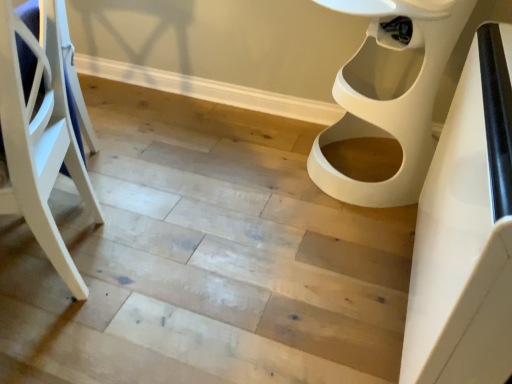
Describe the element at coordinates (40, 137) in the screenshot. Image resolution: width=512 pixels, height=384 pixels. I see `white wood chair at left` at that location.

This screenshot has width=512, height=384. What do you see at coordinates (390, 93) in the screenshot?
I see `white plastic toilet at right` at bounding box center [390, 93].

Find the location of a particular element. white wood chair at left is located at coordinates (40, 137).

From the image's perspective, is white plastic toilet at right positioned above or below white wood chair at left?

Clearly, from the image's perspective, white plastic toilet at right is above white wood chair at left.

Can you tell me how much white plastic toilet at right and white wood chair at left differ in facing direction?

The angular difference between white plastic toilet at right and white wood chair at left is 69.2 degrees.

Which is behind, white plastic toilet at right or white wood chair at left?

white plastic toilet at right is more distant.

Which object is thinner, white glossy table at right or white plastic toilet at right?

Thinner between the two is white glossy table at right.

In terms of size, does white glossy table at right appear bigger or smaller than white plastic toilet at right?

white glossy table at right is smaller than white plastic toilet at right.

Does white glossy table at right come behind white plastic toilet at right?

No, white glossy table at right is closer to the viewer.

Which is more to the left, white glossy table at right or white plastic toilet at right?

From the viewer's perspective, white plastic toilet at right appears more on the left side.

Is point (416, 127) closer to camera compared to point (467, 374)?

No, (416, 127) is further to viewer.

Between white plastic toilet at right and white glossy table at right, which one has smaller width?

Thinner between the two is white glossy table at right.

Considering the relative positions of white plastic toilet at right and white glossy table at right in the image provided, is white plastic toilet at right to the right of white glossy table at right from the viewer's perspective?

In fact, white plastic toilet at right is to the left of white glossy table at right.

In the image, is white wood chair at left on the left side or the right side of white plastic toilet at right?

In the image, white wood chair at left appears on the left side of white plastic toilet at right.

Is white wood chair at left aimed at white plastic toilet at right?

No, white wood chair at left is not facing towards white plastic toilet at right.

You are a GUI agent. You are given a task and a screenshot of the screen. Output one action in this format:
    pyautogui.click(x=<x>, y=<y>)
    Task: Click on the furniture in front of the white plastic toilet at right
    The image size is (512, 384).
    Given the screenshot: What is the action you would take?
    pyautogui.click(x=40, y=137)

Is white wood chair at left spatially inside white plastic toilet at right, or outside of it?

white wood chair at left is outside white plastic toilet at right.

Is white glossy table at right oriented towards white wood chair at left?

Yes, white glossy table at right is oriented towards white wood chair at left.

In the scene shown: Considering the relative positions of white glossy table at right and white wood chair at left in the image provided, is white glossy table at right to the left of white wood chair at left from the viewer's perspective?

No, white glossy table at right is not to the left of white wood chair at left.

Consider the image. Which object is wider, white glossy table at right or white wood chair at left?

white wood chair at left is wider.

From the image's perspective, is white glossy table at right located beneath white wood chair at left?

Yes, from the image's perspective, white glossy table at right is beneath white wood chair at left.

From their relative heights in the image, would you say white wood chair at left is taller or shorter than white glossy table at right?

white wood chair at left is taller than white glossy table at right.

Is white wood chair at left thinner than white glossy table at right?

In fact, white wood chair at left might be wider than white glossy table at right.

Is white wood chair at left bigger or smaller than white glossy table at right?

Clearly, white wood chair at left is larger in size than white glossy table at right.

The width and height of the screenshot is (512, 384). In order to click on furniture below the white plastic toilet at right (from the image's perspective) in this screenshot , I will do `click(40, 137)`.

Where is `table in front of the white plastic toilet at right`? This screenshot has height=384, width=512. table in front of the white plastic toilet at right is located at coordinates (466, 231).

Looking at the image, which one is located further to white wood chair at left, white plastic toilet at right or white glossy table at right?

Based on the image, white plastic toilet at right appears to be further to white wood chair at left.

Which object lies further to the anchor point white glossy table at right, white plastic toilet at right or white wood chair at left?

white wood chair at left is further to white glossy table at right.

Based on their spatial positions, is white glossy table at right or white wood chair at left closer to white plastic toilet at right?

white glossy table at right.

Looking at the image, which one is located further to white glossy table at right, white wood chair at left or white plastic toilet at right?

white wood chair at left.

Considering their positions, is white glossy table at right positioned closer to white wood chair at left than white plastic toilet at right?

Among the two, white glossy table at right is located nearer to white wood chair at left.

From the image, which object appears to be farther from white plastic toilet at right, white wood chair at left or white glossy table at right?

white wood chair at left is further to white plastic toilet at right.

Image resolution: width=512 pixels, height=384 pixels. Find the location of `toilet situated between white wood chair at left and white glossy table at right from left to right`. toilet situated between white wood chair at left and white glossy table at right from left to right is located at coordinates [390, 93].